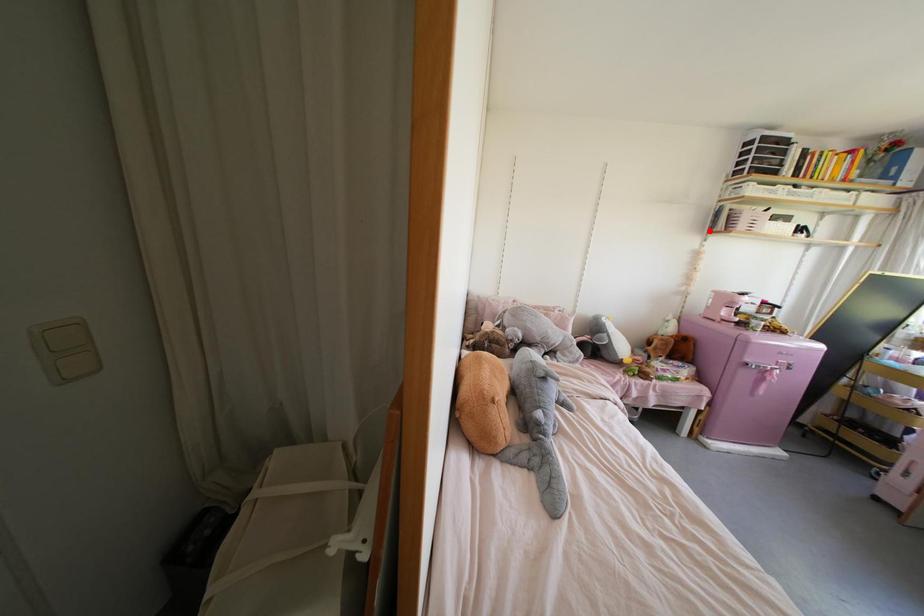
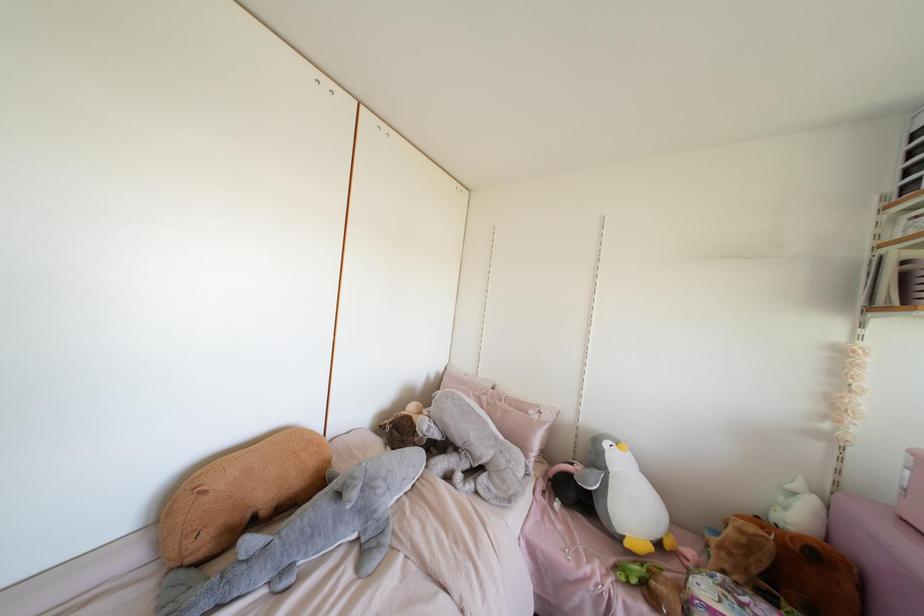
Locate, in the second image, the point that corresponds to the highlighted location in the first image.

(870, 307)